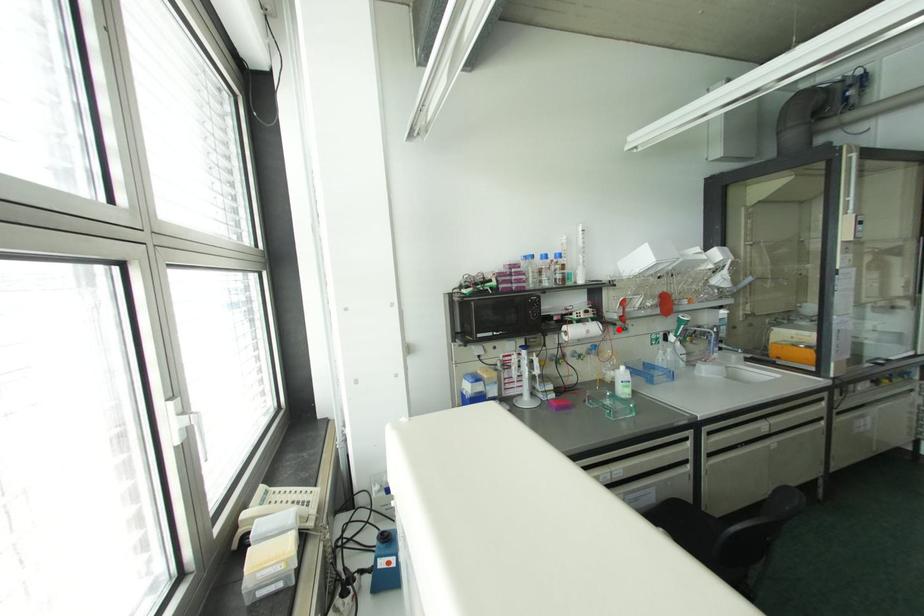
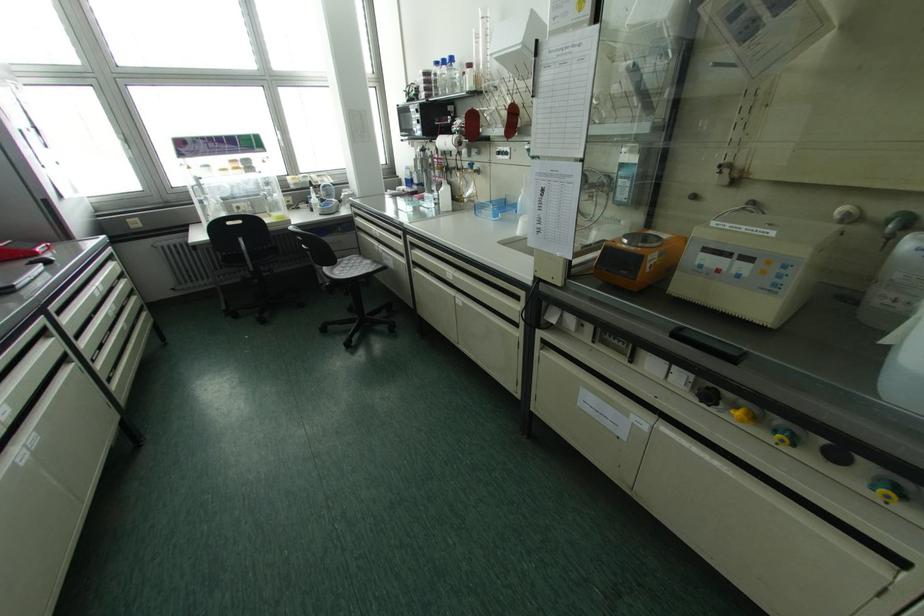
In the second image, find the point that corresponds to the highlighted location in the first image.

(497, 153)